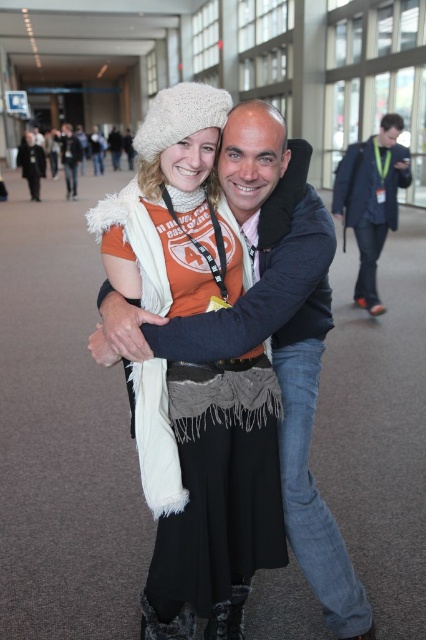
You are standing in the corridor and see a point marked at coordinates (x=371, y=198). Based on the scene description, where is this point located?

The point is located on the dark blue suit at center.

You are a photographer trying to capture a closeup of the white woolen hat at upper center and the matte black jacket at center. Which object should you zoom in on to ensure both are in frame without moving the camera?

The white woolen hat at upper center might be wider than the matte black jacket at center, so you should zoom in on the matte black jacket at center to ensure both are in frame without moving the camera.